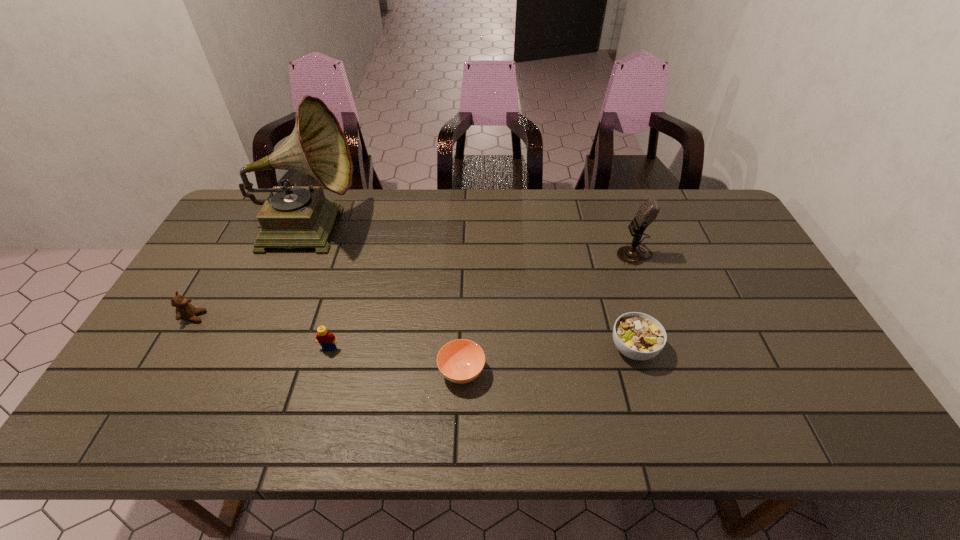
Image resolution: width=960 pixels, height=540 pixels. What are the coordinates of `free space between the tallest object and the left soup bowl` in the screenshot? It's located at (386, 300).

Where is `vacant space in between the shorter soup bowl and the record player`? vacant space in between the shorter soup bowl and the record player is located at coordinates (386, 300).

The width and height of the screenshot is (960, 540). In order to click on blank region between the record player and the second tallest object in this screenshot , I will do `click(472, 240)`.

The width and height of the screenshot is (960, 540). I want to click on free space between the Lego and the shorter soup bowl, so click(x=396, y=360).

Where is `free point between the record player and the microphone`? This screenshot has height=540, width=960. free point between the record player and the microphone is located at coordinates (472, 240).

At what (x,y) coordinates should I click in order to perform the action: click on empty space that is in between the record player and the fourth nearest object. Please return your answer as a coordinate pair (x, y). The height and width of the screenshot is (540, 960). Looking at the image, I should click on (252, 272).

I want to click on vacant region between the tallest object and the Lego, so click(320, 288).

At what (x,y) coordinates should I click in order to perform the action: click on free space between the second tallest object and the record player. Please return your answer as a coordinate pair (x, y). This screenshot has width=960, height=540. Looking at the image, I should click on (472, 240).

Identify the location of free space between the teddy bear and the tallest object. (252, 272).

At what (x,y) coordinates should I click in order to perform the action: click on object that is the second closest one to the Lego. Please return your answer as a coordinate pair (x, y). Looking at the image, I should click on (291, 217).